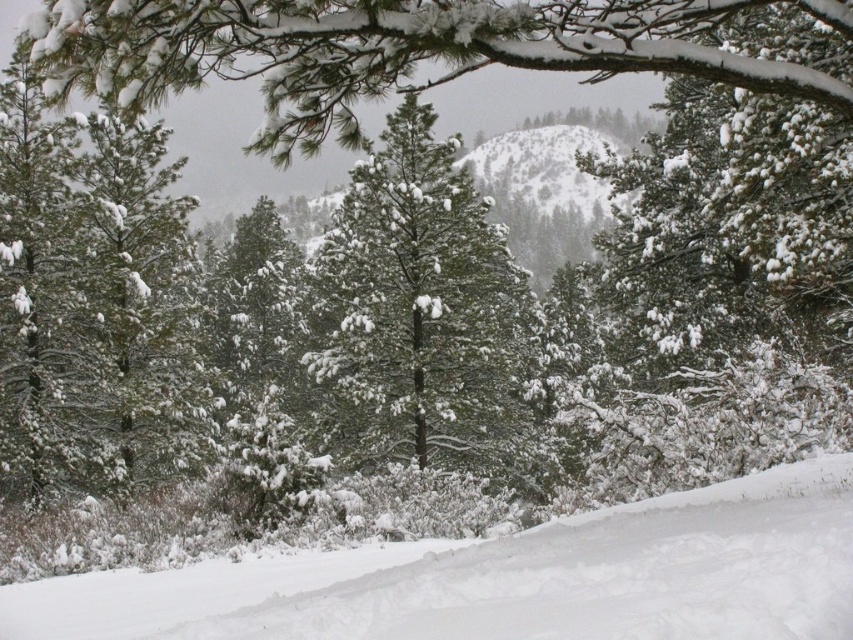
You are planning to build a small cabin for winter sports enthusiasts. The cabin must be placed on the white snow ski slope at lower center but must also be visible from the green matte tree at center. Considering their height relationship, is this possible?

The white snow ski slope at lower center has a lesser height compared to the green matte tree at center. Therefore, placing the cabin on the lower slope would allow it to be visible from the higher elevation of the tree.

You are planning to ski down the white snow ski slope at lower center. There is a green matte tree at center in the way. Based on their positions, can you safely ski around it without hitting the tree?

The white snow ski slope at lower center is below the green matte tree at center, so you can safely ski around it by going around the tree located above the slope.

You are a skier planning to descend the white snow ski slope at lower center and the green matte tree at center. Which one is closer to you?

The white snow ski slope at lower center is closer to the viewer than the green matte tree at center.